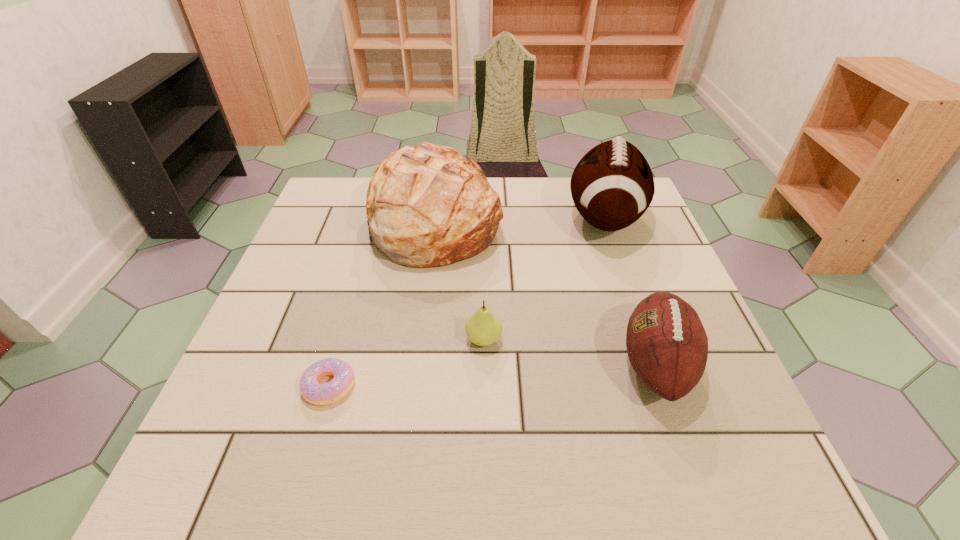
Find the location of `free space at the far left corner of the desktop`. free space at the far left corner of the desktop is located at coordinates (334, 193).

Find the location of `vacant space at the near right corner of the desktop`. vacant space at the near right corner of the desktop is located at coordinates point(726,442).

Locate an element on the screen. empty space that is in between the farther football (American) and the shortest object is located at coordinates (467, 302).

Locate an element on the screen. The width and height of the screenshot is (960, 540). empty location between the doughnut and the bread is located at coordinates (382, 303).

At what (x,y) coordinates should I click in order to perform the action: click on empty space that is in between the bread and the third shortest object. Please return your answer as a coordinate pair (x, y). The width and height of the screenshot is (960, 540). Looking at the image, I should click on (544, 292).

The height and width of the screenshot is (540, 960). Identify the location of vacant region between the shortest object and the fourth tallest object. (407, 363).

Where is `vacant region between the farther football (American) and the doughnut`? The height and width of the screenshot is (540, 960). vacant region between the farther football (American) and the doughnut is located at coordinates (467, 302).

The image size is (960, 540). I want to click on free space that is in between the second shortest object and the farther football (American), so click(544, 279).

Find the location of a particular element. The image size is (960, 540). free space between the shortest object and the bread is located at coordinates (382, 303).

Find the location of a particular element. Image resolution: width=960 pixels, height=540 pixels. vacant space that is in between the fourth tallest object and the bread is located at coordinates (459, 280).